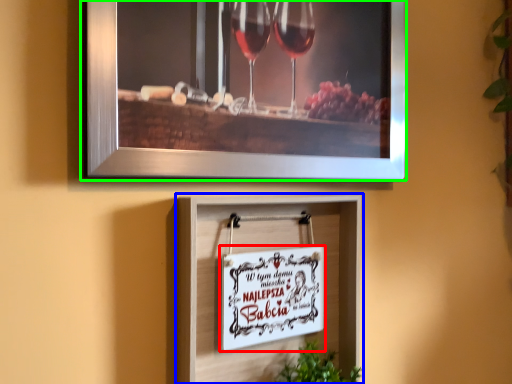
Question: Considering the real-world distances, which object is closest to picture frame (highlighted by a red box)? picture frame (highlighted by a blue box) or picture frame (highlighted by a green box).

Choices:
 (A) picture frame
 (B) picture frame

Answer: (A)